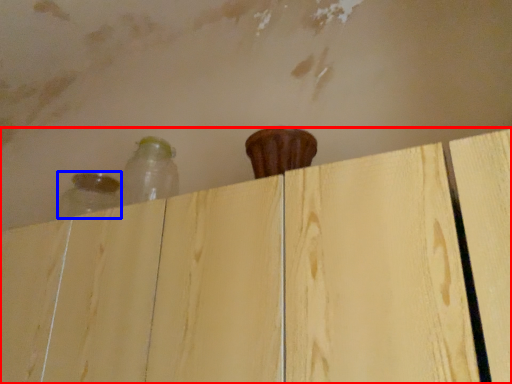
Question: Which point is closer to the camera, dresser (highlighted by a red box) or bottle (highlighted by a blue box)?

Choices:
 (A) dresser
 (B) bottle

Answer: (A)